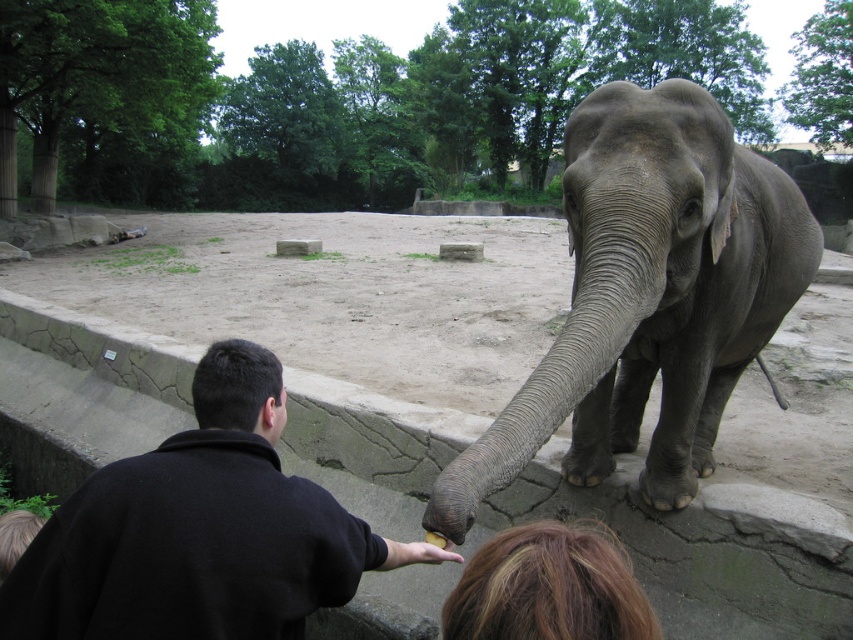
Can you confirm if gray matte elephant at center is taller than black fleece jacket at lower left?

Correct, gray matte elephant at center is much taller as black fleece jacket at lower left.

Identify the location of gray matte elephant at center. Image resolution: width=853 pixels, height=640 pixels. (648, 298).

I want to click on gray matte elephant at center, so click(x=648, y=298).